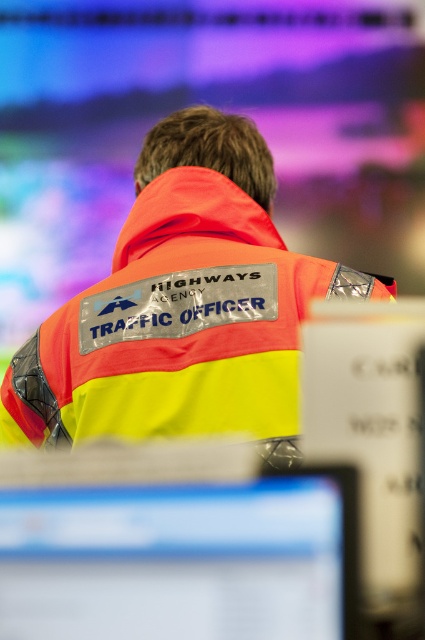
You are an office manager checking desk space for a new employee. You see the orange reflective jacket at center and the matte plastic monitor at lower center on the desk. Which object takes up more horizontal space on the desk?

The orange reflective jacket at center takes up more horizontal space on the desk because its width is larger than that of the matte plastic monitor at lower center.

You are an office worker who needs to reach the matte plastic monitor at lower center to retrieve a document. The orange reflective jacket at center is in your way. Can you move around it to access the monitor?

The orange reflective jacket at center is located above the matte plastic monitor at lower center, so you can move around it to access the monitor since it is positioned above and not blocking the sides.

Based on the photo, you are an office manager inspecting the workstation setup. You notice the orange reflective jacket at center and the matte plastic monitor at lower center. Which object is taller?

The orange reflective jacket at center is taller than the matte plastic monitor at lower center.